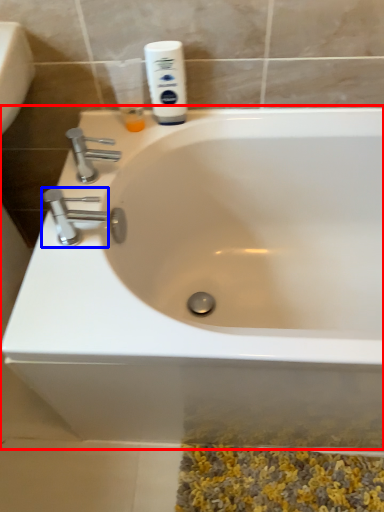
Question: Which point is further to the camera, bathtub (highlighted by a red box) or tap (highlighted by a blue box)?

Choices:
 (A) bathtub
 (B) tap

Answer: (B)